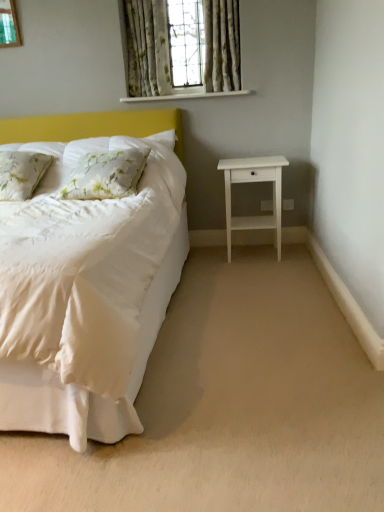
This screenshot has width=384, height=512. I want to click on blank space above beige carpet at lower center (from a real-world perspective), so click(x=239, y=321).